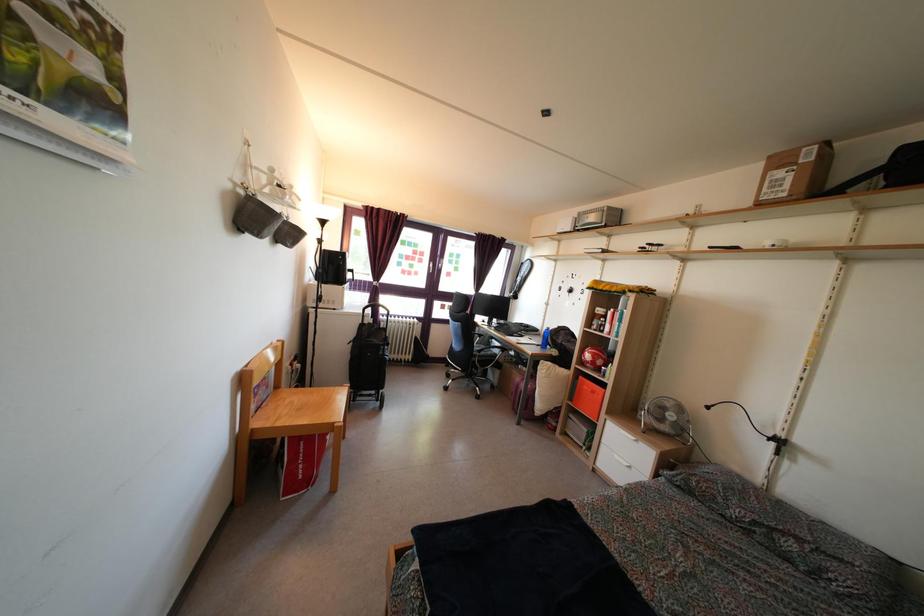
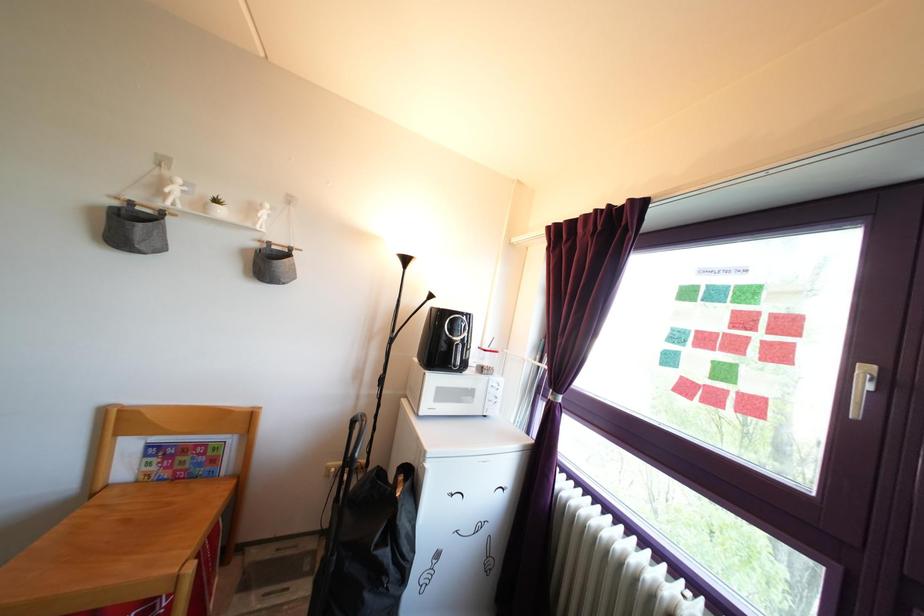
Where in the second image is the point corresponding to point 433,270 from the first image?

(857, 365)